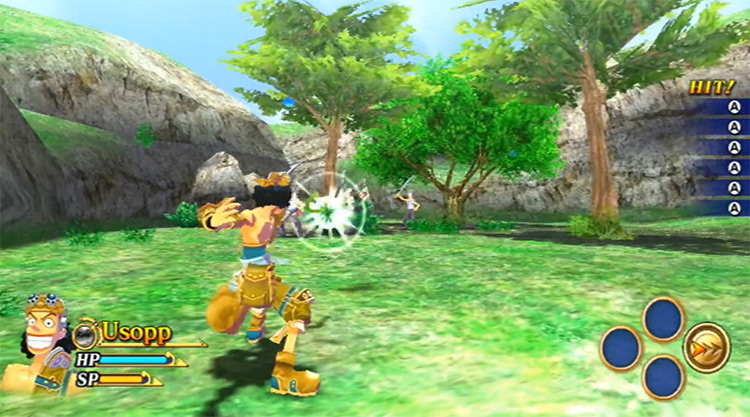
Find the location of a particular element. This screenshot has height=417, width=750. light is located at coordinates (343, 217).